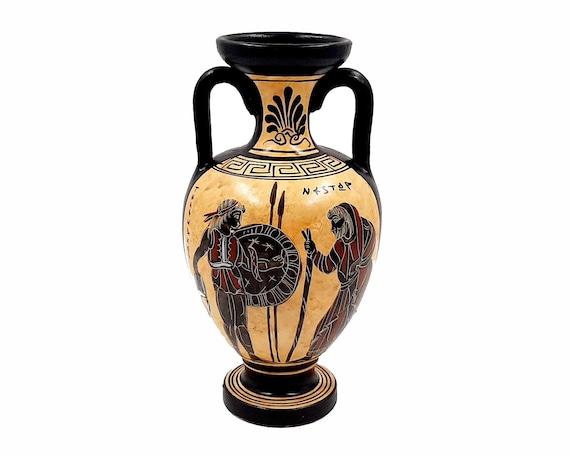
This screenshot has height=456, width=570. Find the location of `top of vase`. top of vase is located at coordinates (286, 33).